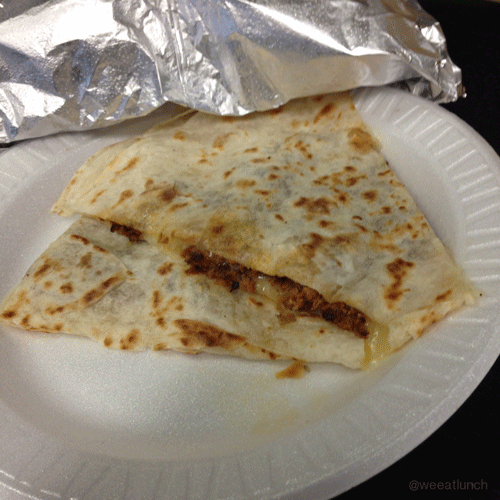
The image size is (500, 500). In order to click on table in this screenshot , I will do `click(475, 118)`, `click(477, 443)`.